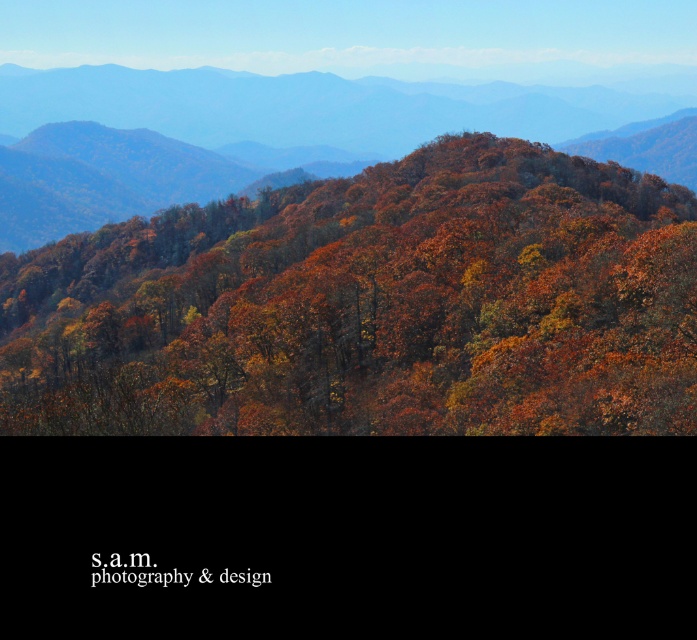
Does autumn leaves at center come in front of autumn foliage at center?

Yes.

Can you confirm if autumn leaves at center is wider than autumn foliage at center?

In fact, autumn leaves at center might be narrower than autumn foliage at center.

The image size is (697, 640). Describe the element at coordinates (369, 307) in the screenshot. I see `autumn leaves at center` at that location.

The width and height of the screenshot is (697, 640). Identify the location of autumn leaves at center. (369, 307).